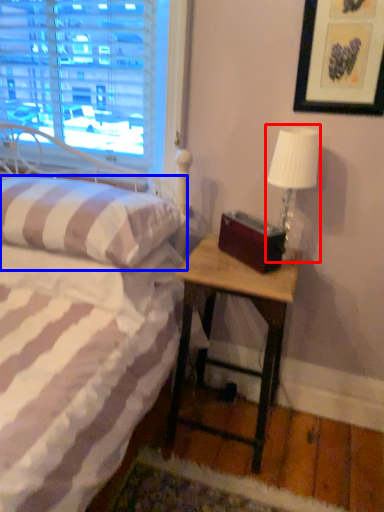
Question: Which point is closer to the camera, table lamp (highlighted by a red box) or pillow (highlighted by a blue box)?

Choices:
 (A) table lamp
 (B) pillow

Answer: (B)